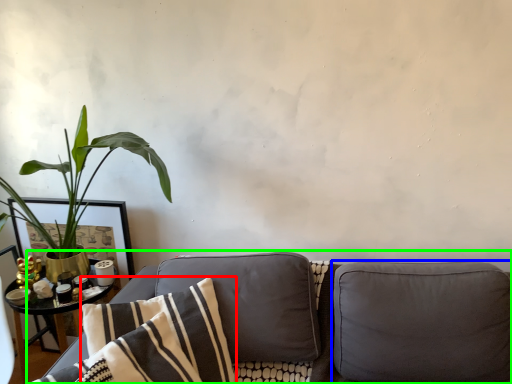
Question: Estimate the real-world distances between objects in this image. Which object is closer to pillow (highlighted by a red box), pillow (highlighted by a blue box) or studio couch (highlighted by a green box)?

Choices:
 (A) pillow
 (B) studio couch

Answer: (B)